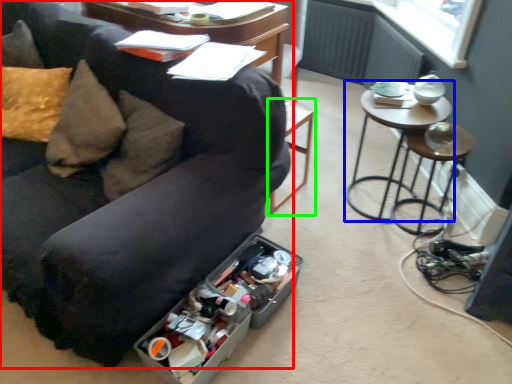
Question: Which object is the closest to the studio couch (highlighted by a red box)? Choose among these: table (highlighted by a blue box) or bar stool (highlighted by a green box).

Choices:
 (A) table
 (B) bar stool

Answer: (B)